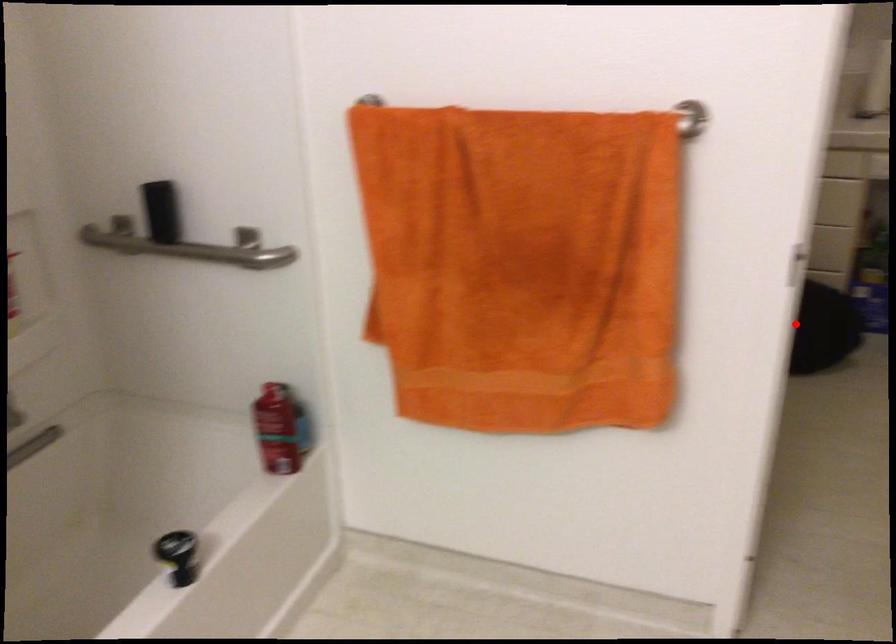
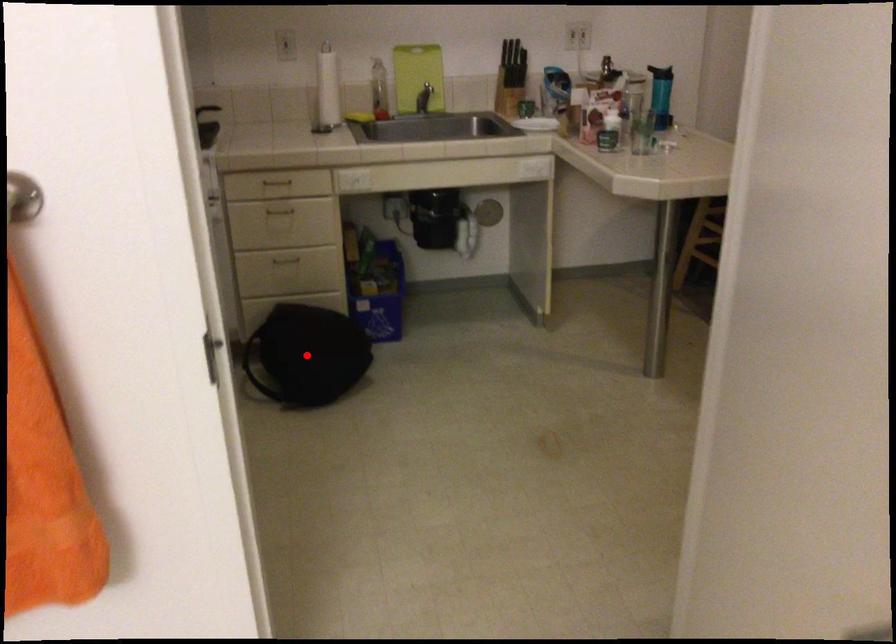
I am providing you with two images of the same scene from different viewpoints. A red point is marked on the first image and another point is marked on the second image. Does the point marked in image1 correspond to the same location as the one in image2?

Yes